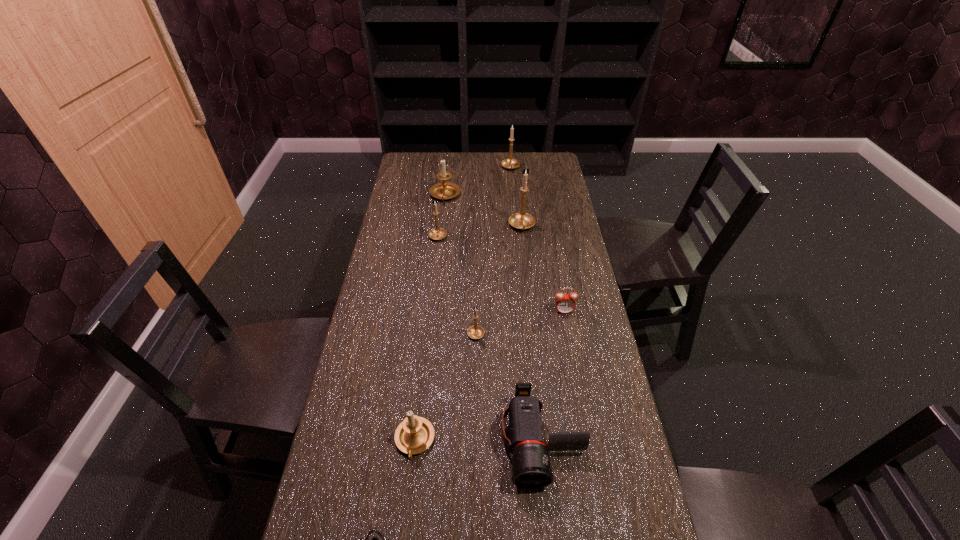
Identify the location of the nearer beige candle holder. This screenshot has height=540, width=960. (415, 434).

At what (x,y) coordinates should I click in order to perform the action: click on alarm clock. Please return your answer as a coordinate pair (x, y). Image resolution: width=960 pixels, height=540 pixels. Looking at the image, I should click on (565, 303).

Image resolution: width=960 pixels, height=540 pixels. I want to click on camcorder, so click(x=531, y=465).

Identify the location of vacant space situated on the handle side of the tallest object. (525, 260).

The width and height of the screenshot is (960, 540). I want to click on free region located on the handle side of the farthest gold candle holder, so click(512, 183).

Image resolution: width=960 pixels, height=540 pixels. Find the location of `free space located 0.310m on the handle side of the leftmost gold candle holder`. free space located 0.310m on the handle side of the leftmost gold candle holder is located at coordinates (444, 185).

Find the location of a particular element. vacant space located on the handle side of the leftmost gold candle holder is located at coordinates (442, 200).

This screenshot has width=960, height=540. Identify the location of vacant region located on the handle side of the leftmost gold candle holder. (440, 216).

Image resolution: width=960 pixels, height=540 pixels. Find the location of `vacant point located 0.170m with a handle on the side of the bigger beige candle holder`. vacant point located 0.170m with a handle on the side of the bigger beige candle holder is located at coordinates (442, 231).

You are a GUI agent. You are given a task and a screenshot of the screen. Output one action in this format:
    pyautogui.click(x=<x>, y=<y>)
    Task: Click on the vacant area situated on the handle side of the nearest gold candle holder
    
    Given the screenshot: What is the action you would take?
    pyautogui.click(x=476, y=284)